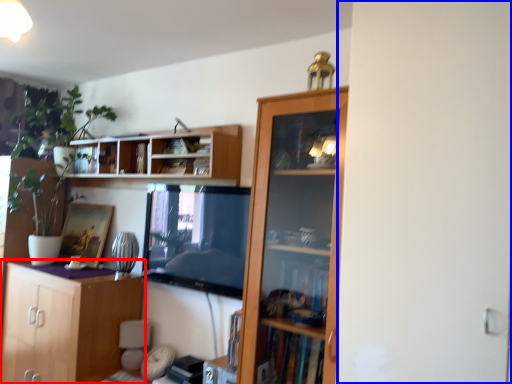
Question: Which object is further to the camera taking this photo, cabinetry (highlighted by a red box) or screen door (highlighted by a blue box)?

Choices:
 (A) cabinetry
 (B) screen door

Answer: (A)